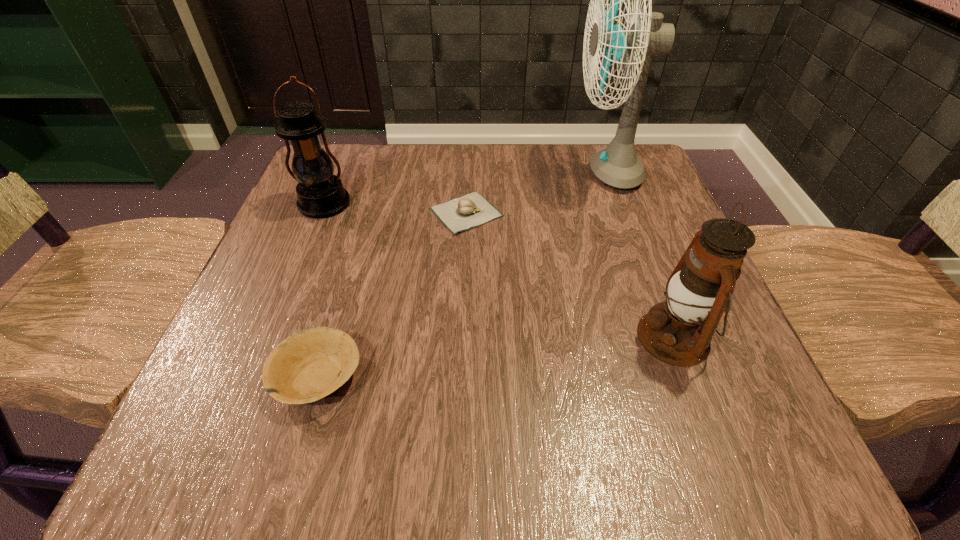
This screenshot has height=540, width=960. I want to click on the tallest object, so coord(617,165).

The width and height of the screenshot is (960, 540). Find the location of `the left lantern`. the left lantern is located at coordinates tap(321, 194).

You are a GUI agent. You are given a task and a screenshot of the screen. Output one action in this format:
    pyautogui.click(x=<x>, y=<y>)
    Task: Click on the nearer lantern
    This screenshot has height=540, width=960.
    Given the screenshot: What is the action you would take?
    pyautogui.click(x=678, y=331)

Identify the location of bowl. This screenshot has height=540, width=960. (309, 365).

Where is `garlic`? garlic is located at coordinates (460, 214).

Identify the location of the shortest object. (460, 214).

The image size is (960, 540). Find the location of `vacant space located on the front-facing side of the tallest object`. vacant space located on the front-facing side of the tallest object is located at coordinates (522, 172).

At what (x,y) coordinates should I click in order to perform the action: click on vacant space situated on the front-facing side of the tallest object. Please return your answer as a coordinate pair (x, y). The height and width of the screenshot is (540, 960). Looking at the image, I should click on (446, 172).

Identify the location of free location located 0.180m on the front-facing side of the tallest object. This screenshot has height=540, width=960. (x=491, y=172).

Find several locations within the vacant space located above the farther lantern, indicating its light source. Please provide its 2D coordinates. Your answer should be formatted as a tuple, i.e. [(x, y)], where the tuple contains the x and y coordinates of a point satisfying the conditions above.

[(279, 314)]